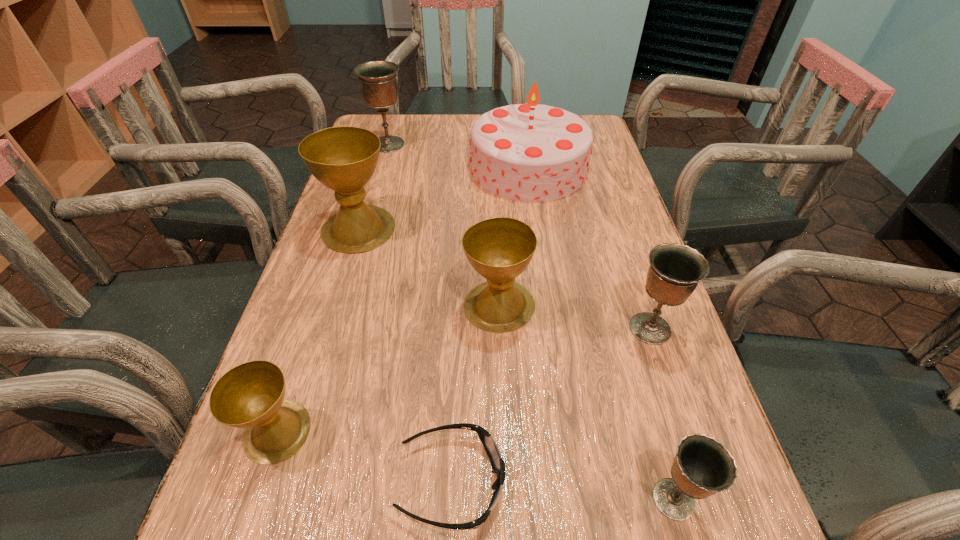
Choose which object is the sixth nearest neighbor to the farthest bronze chalice. Please provide its 2D coordinates. Your answer should be formatted as a tuple, i.e. [(x, y)], where the tuple contains the x and y coordinates of a point satisfying the conditions above.

[(498, 465)]

Identify the location of chalice object that ranks as the fourth closest to the biggest bronze chalice. The width and height of the screenshot is (960, 540). (251, 395).

You are a GUI agent. You are given a task and a screenshot of the screen. Output one action in this format:
    pyautogui.click(x=<x>, y=<y>)
    Task: Click on the chalice that is the fourth closest to the fifth nearest chalice
    The width and height of the screenshot is (960, 540).
    Given the screenshot: What is the action you would take?
    pyautogui.click(x=675, y=270)

The image size is (960, 540). I want to click on brown chalice identified as the closest to the second biggest bronze chalice, so click(x=499, y=249).

Identify which brown chalice is located as the third nearest to the birthday cake. Please provide its 2D coordinates. Your answer should be formatted as a tuple, i.e. [(x, y)], where the tuple contains the x and y coordinates of a point satisfying the conditions above.

[(251, 395)]

What are the coordinates of `the closest bronze chalice to the birthday cake` in the screenshot? It's located at (378, 82).

At what (x,y) coordinates should I click in order to perform the action: click on the second closest bronze chalice relative to the leftmost bronze chalice. Please return your answer as a coordinate pair (x, y). The height and width of the screenshot is (540, 960). Looking at the image, I should click on (703, 466).

What are the coordinates of `free space that satisfies the following two spatial constraints: 1. on the front side of the second nearest brown chalice; 2. on the right side of the nearest bronze chalice` in the screenshot? It's located at (507, 499).

Find the location of a particular element. vacant point that satisfies the following two spatial constraints: 1. on the front side of the birthday cake; 2. on the right side of the leftmost bronze chalice is located at coordinates (382, 167).

You are a GUI agent. You are given a task and a screenshot of the screen. Output one action in this format:
    pyautogui.click(x=<x>, y=<y>)
    Task: Click on the free location that satisfies the following two spatial constraints: 1. on the lenses of the sunglasses; 2. on the right side of the nearest bronze chalice
    The height and width of the screenshot is (540, 960).
    Given the screenshot: What is the action you would take?
    pyautogui.click(x=451, y=499)